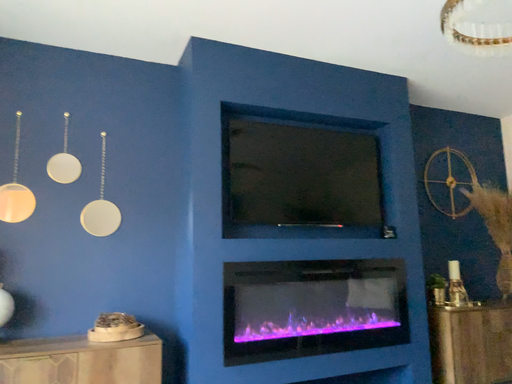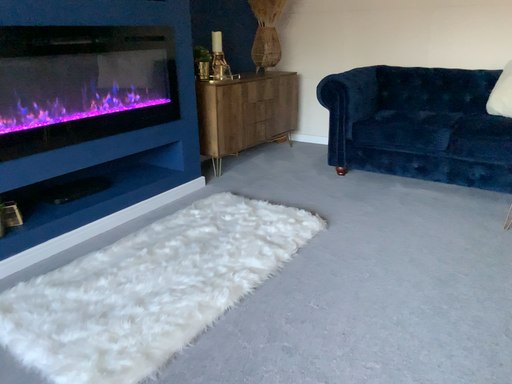
Question: Which way did the camera rotate in the video?

Choices:
 (A) rotated left
 (B) rotated right

Answer: (B)